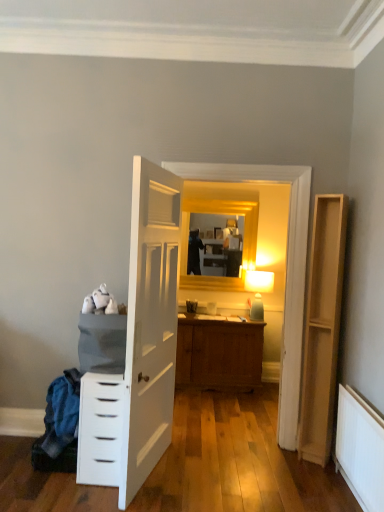
Question: Is gold wooden mirror at upper center bigger or smaller than white glossy chest of drawers at left?

Choices:
 (A) small
 (B) big

Answer: (A)

Question: From the image's perspective, is gold wooden mirror at upper center located above or below white glossy chest of drawers at left?

Choices:
 (A) above
 (B) below

Answer: (A)

Question: Which object is positioned closest to the gold wooden mirror at upper center?

Choices:
 (A) white glossy chest of drawers at left
 (B) light brown wood file cabinet at right
 (C) matte green glass at upper center
 (D) white fabric laundry at lower left
 (E) white painted radiator at lower right

Answer: (C)

Question: Which object is positioned farthest from the white painted radiator at lower right?

Choices:
 (A) light brown wood file cabinet at right
 (B) white glossy chest of drawers at left
 (C) matte green glass at upper center
 (D) gold wooden mirror at upper center
 (E) white fabric laundry at lower left

Answer: (D)